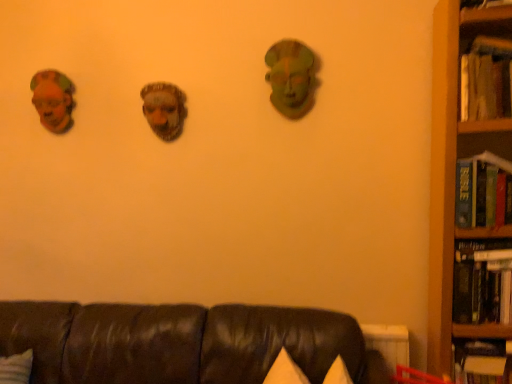
Question: Is point (97, 321) closer or farther from the camera than point (467, 349)?

Choices:
 (A) closer
 (B) farther

Answer: (B)

Question: In the image, is leather couch at lower center on the left side or the right side of hardcover book at right, acting as the 4th book starting from the top?

Choices:
 (A) left
 (B) right

Answer: (A)

Question: Estimate the real-world distances between objects in this image. Which object is closer to the hardcover book at right, which is the fourth book from bottom to top?

Choices:
 (A) hardcover book at right, the third book when ordered from bottom to top
 (B) matte brown mask at left
 (C) hardcover book at right, marked as the third book in a top-to-bottom arrangement
 (D) hardcover book at right, acting as the 4th book starting from the top
 (E) leather couch at lower center

Answer: (A)

Question: Which object is positioned farthest from the leather couch at lower center?

Choices:
 (A) wooden bookcase at right
 (B) hardcover book at right, the third book when ordered from bottom to top
 (C) hardcover book at right, positioned as the 2th book in bottom-to-top order
 (D) hardcover book at right, which is the fourth book from bottom to top
 (E) hardcover book at right, acting as the 4th book starting from the top

Answer: (D)